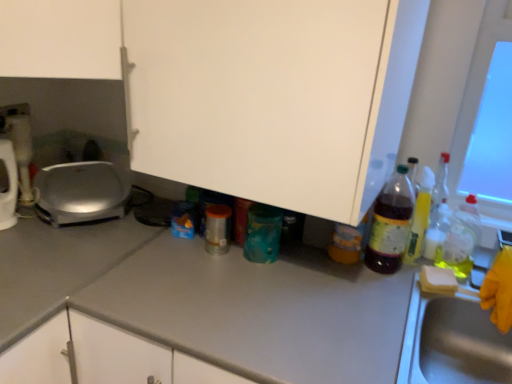
Where is `free location above gray matte countertop at center (from a real-world perspective)`? The height and width of the screenshot is (384, 512). free location above gray matte countertop at center (from a real-world perspective) is located at coordinates (308, 287).